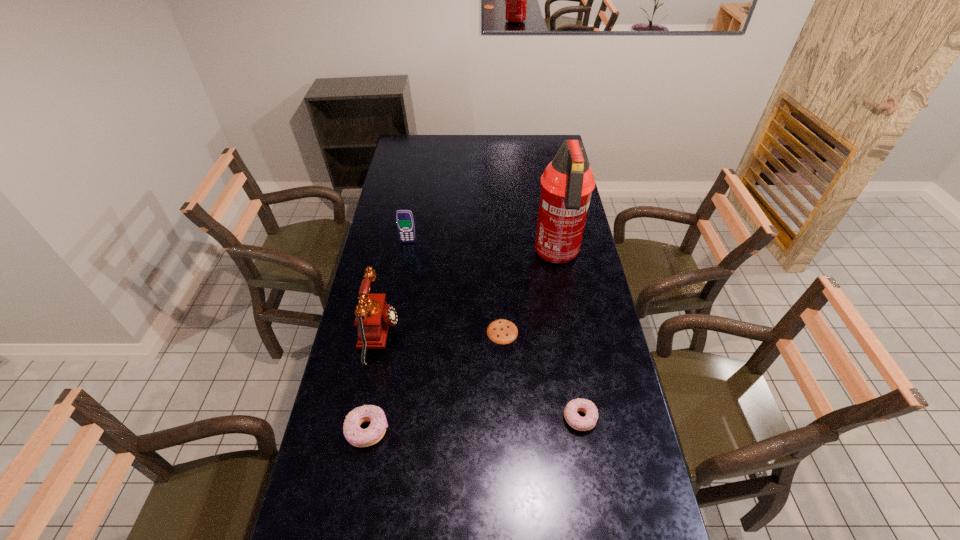
To make them evenly spaced by inserting another doughnut among them, please locate a vacant spot for this new doughnut. Please provide its 2D coordinates. Your answer should be formatted as a tuple, i.e. [(x, y)], where the tuple contains the x and y coordinates of a point satisfying the conditions above.

[(475, 424)]